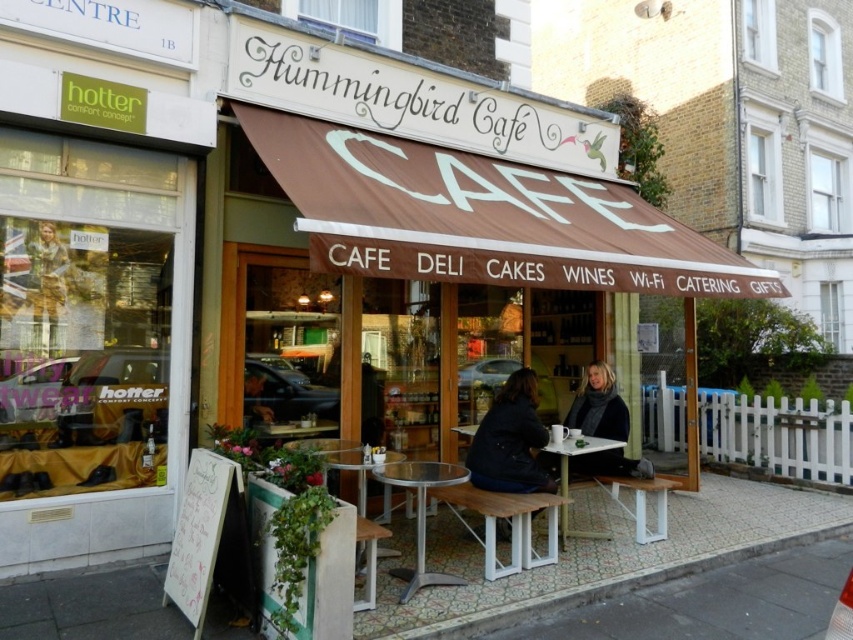
Question: Is dark gray scarf at lower center positioned at the back of white plastic table at center?

Choices:
 (A) yes
 (B) no

Answer: (A)

Question: Considering the real-world distances, which object is closest to the metallic silver table at center?

Choices:
 (A) dark gray scarf at lower center
 (B) dark blue jacket at center
 (C) white plastic table at center

Answer: (B)

Question: Which object appears closest to the camera in this image?

Choices:
 (A) metallic silver table at center
 (B) white plastic table at center

Answer: (A)

Question: In this image, where is dark gray scarf at lower center located relative to metallic silver table at center?

Choices:
 (A) above
 (B) below

Answer: (A)

Question: Which point is closer to the camera?

Choices:
 (A) dark blue jacket at center
 (B) metallic silver table at center
 (C) dark gray scarf at lower center

Answer: (B)

Question: Can you confirm if dark gray scarf at lower center is bigger than metallic silver table at center?

Choices:
 (A) yes
 (B) no

Answer: (A)